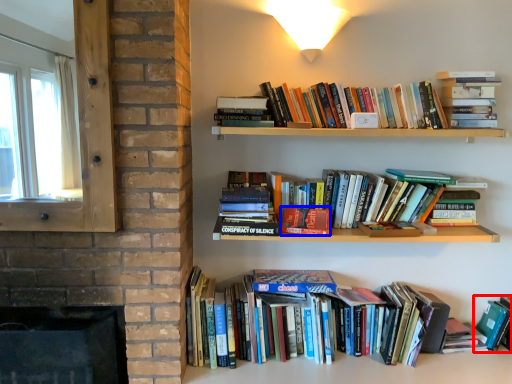
Question: Which object is closer to the camera taking this photo, book (highlighted by a red box) or paperback book (highlighted by a blue box)?

Choices:
 (A) book
 (B) paperback book

Answer: (B)